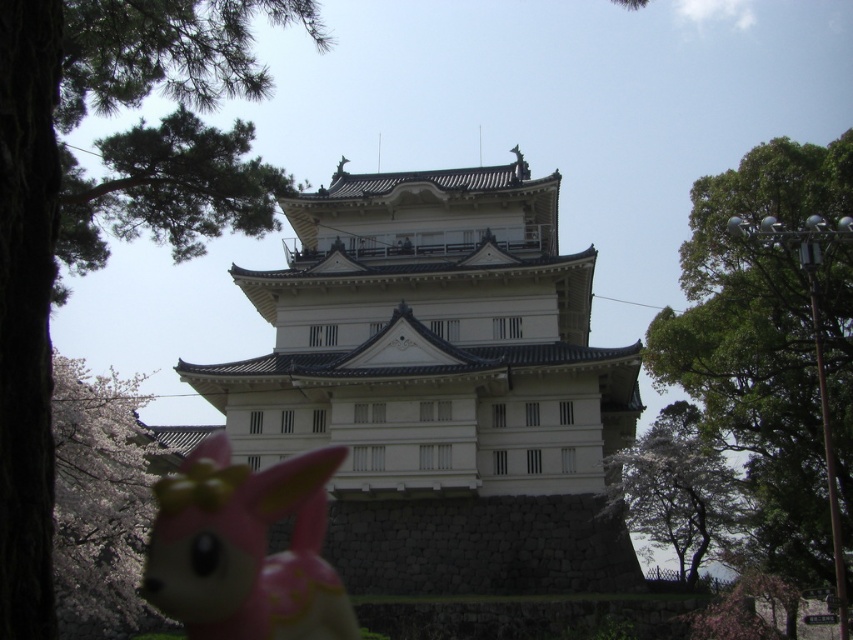
You are a photographer planning to take a picture of the green leafy tree at left and the white blossoms at lower left. Based on their positions, which object should you focus on first if you want to capture both in a single frame without moving the camera?

The green leafy tree at left is located above the white blossoms at lower left, so you should focus on the white blossoms at lower left first since it is closer to the camera and occupies the lower part of the frame, ensuring both can be captured in the same shot.